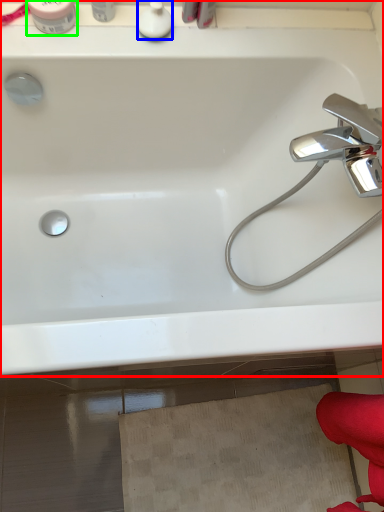
Question: Which object is positioned farthest from bathtub (highlighted by a red box)? Select from toiletry (highlighted by a blue box) and toiletry (highlighted by a green box).

Choices:
 (A) toiletry
 (B) toiletry

Answer: (B)